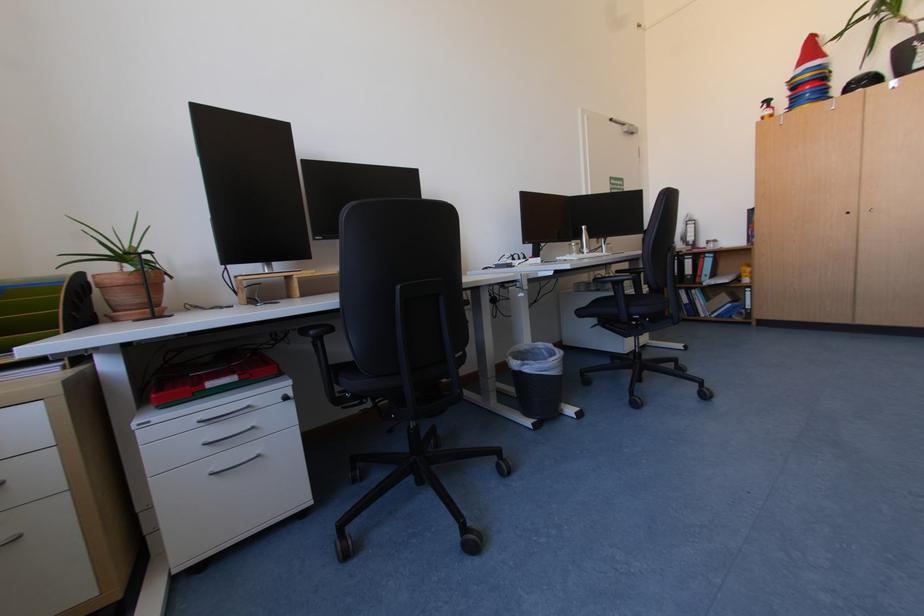
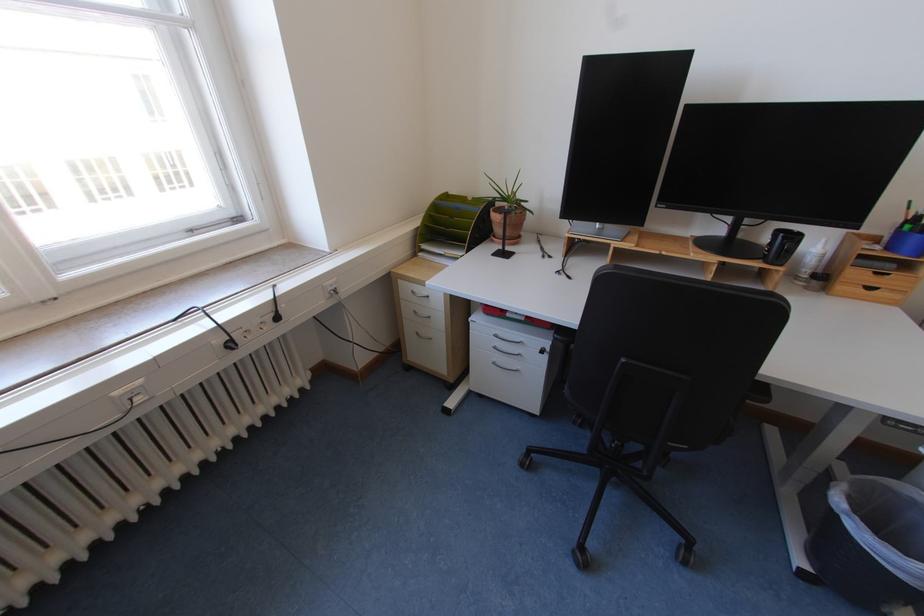
Find the pixel in the second image that matches point 542,421 in the first image.

(819, 572)